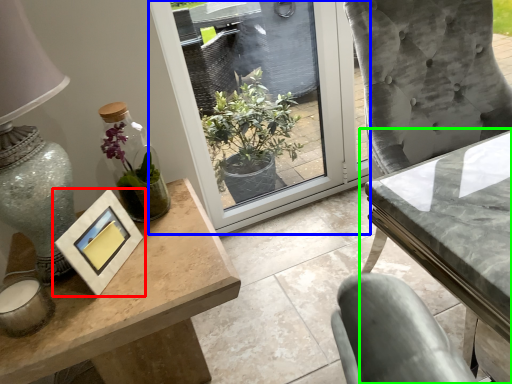
Question: Estimate the real-world distances between objects in this image. Which object is farther from picture frame (highlighted by a red box), window (highlighted by a blue box) or table (highlighted by a green box)?

Choices:
 (A) window
 (B) table

Answer: (A)